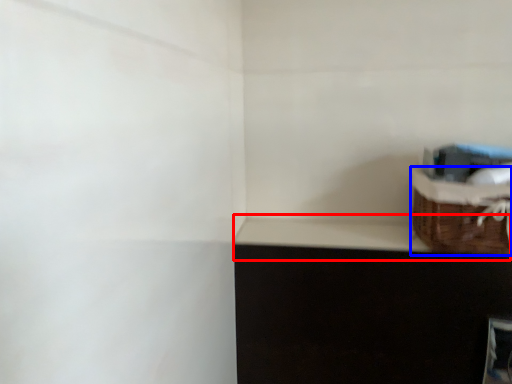
Question: Which object appears farthest to the camera in this image, window sill (highlighted by a red box) or basket (highlighted by a blue box)?

Choices:
 (A) window sill
 (B) basket

Answer: (A)